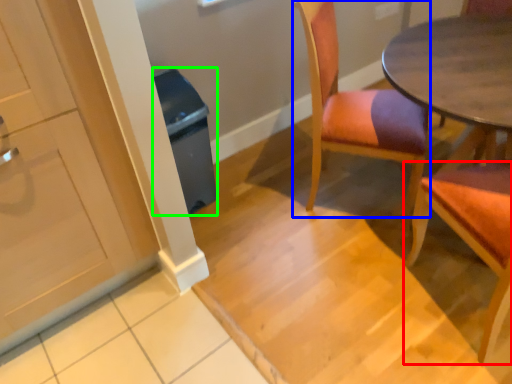
Question: Which object is positioned closest to chair (highlighted by a red box)? Select from chair (highlighted by a blue box) and trash bin/can (highlighted by a green box).

Choices:
 (A) chair
 (B) trash bin/can

Answer: (A)